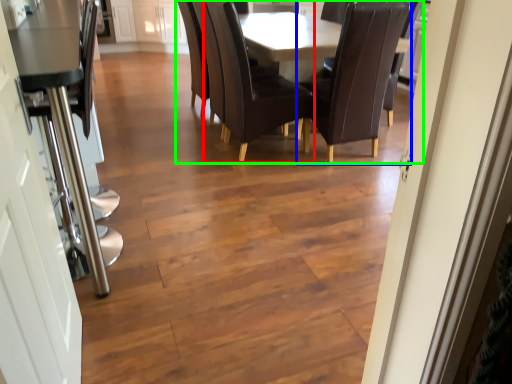
Question: Estimate the real-world distances between objects in this image. Which object is closer to chair (highlighted by a red box), chair (highlighted by a blue box) or kitchen & dining room table (highlighted by a green box)?

Choices:
 (A) chair
 (B) kitchen & dining room table

Answer: (B)